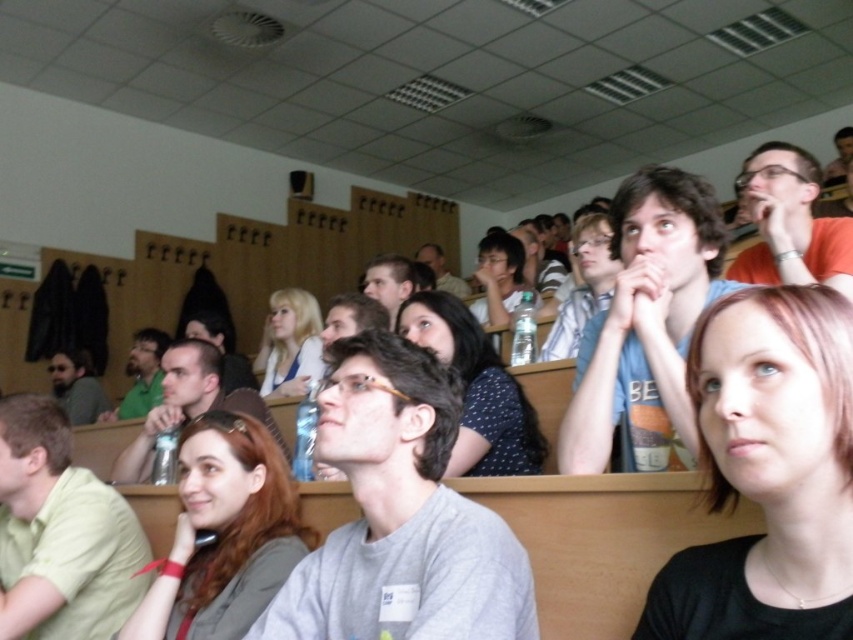
Question: Is black matte shirt at center closer to the viewer compared to gray matte shirt at center?

Choices:
 (A) no
 (B) yes

Answer: (B)

Question: Which of these objects is positioned farthest from the blonde hair at center?

Choices:
 (A) polka dot shirt at center
 (B) matte brown hair at center
 (C) matte blue shirt at center
 (D) gray matte shirt at center

Answer: (D)

Question: Does gray matte shirt at center appear under matte brown hair at center?

Choices:
 (A) no
 (B) yes

Answer: (A)

Question: Which point is farther to the camera?

Choices:
 (A) matte blue shirt at center
 (B) blonde hair at center

Answer: (B)

Question: In this image, where is gray matte shirt at center located relative to matte brown hair at center?

Choices:
 (A) right
 (B) left

Answer: (A)

Question: Which object appears farthest from the camera in this image?

Choices:
 (A) matte blue shirt at center
 (B) polka dot shirt at center
 (C) black matte shirt at center
 (D) blonde hair at center

Answer: (D)